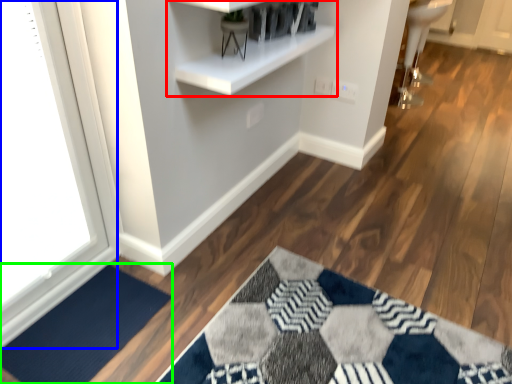
Question: Considering the real-world distances, which object is farthest from shelf (highlighted by a red box)? window (highlighted by a blue box) or doormat (highlighted by a green box)?

Choices:
 (A) window
 (B) doormat

Answer: (B)